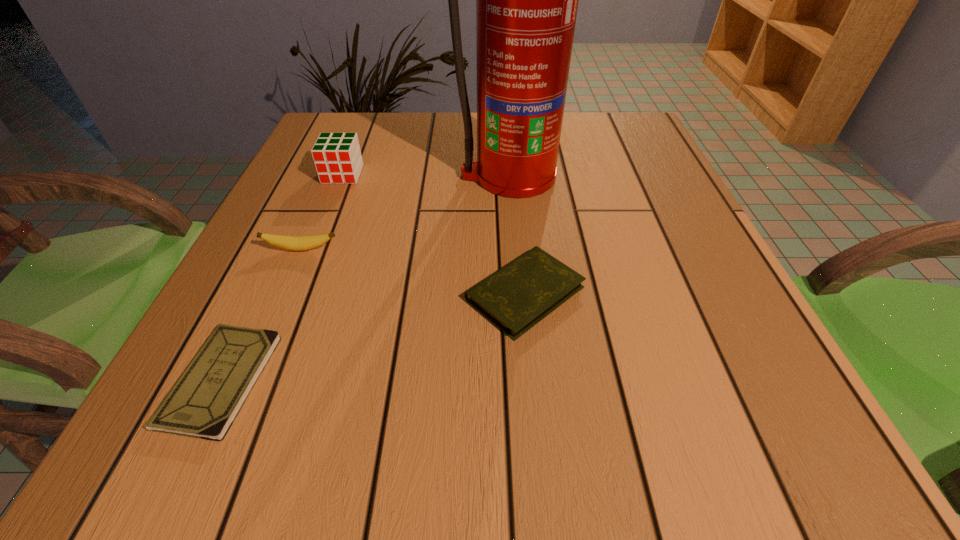
Where is `free spot at the far left corner of the desktop`? This screenshot has width=960, height=540. free spot at the far left corner of the desktop is located at coordinates (337, 122).

The image size is (960, 540). I want to click on free space at the near left corner of the desktop, so click(x=233, y=442).

Where is `vacant space at the far right corner of the desktop`? Image resolution: width=960 pixels, height=540 pixels. vacant space at the far right corner of the desktop is located at coordinates (628, 150).

Locate an element on the screen. The height and width of the screenshot is (540, 960). vacant area that lies between the checkbook and the banana is located at coordinates (261, 315).

The image size is (960, 540). Find the location of `unoccupied position between the checkbook and the fourth shortest object`. unoccupied position between the checkbook and the fourth shortest object is located at coordinates (282, 277).

Locate an element on the screen. The height and width of the screenshot is (540, 960). free spot between the second shortest object and the tallest object is located at coordinates (517, 234).

Identify the location of vacant point located between the fourth tallest object and the shortest object. (373, 336).

Image resolution: width=960 pixels, height=540 pixels. I want to click on free area in between the tallest object and the diary, so click(x=517, y=234).

Find the location of a particular element. The width and height of the screenshot is (960, 540). vacant space in between the cube and the shortest object is located at coordinates (282, 277).

This screenshot has height=540, width=960. I want to click on unoccupied area between the tallest object and the third shortest object, so click(x=405, y=213).